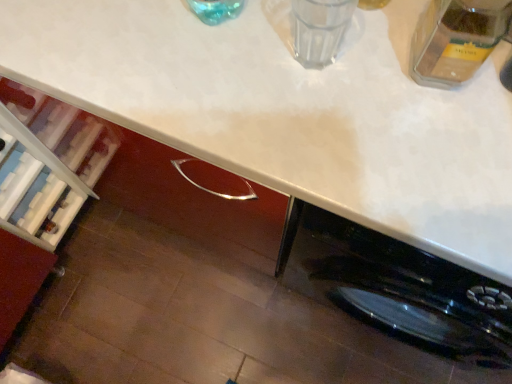
Question: Does transparent glass at upper center have a larger size compared to transparent glass jar at upper right?

Choices:
 (A) yes
 (B) no

Answer: (B)

Question: Could you tell me if transparent glass at upper center is facing transparent glass jar at upper right?

Choices:
 (A) yes
 (B) no

Answer: (B)

Question: Considering the relative sizes of transparent glass at upper center and transparent glass jar at upper right in the image provided, is transparent glass at upper center taller than transparent glass jar at upper right?

Choices:
 (A) no
 (B) yes

Answer: (A)

Question: Is the position of transparent glass at upper center more distant than that of transparent glass jar at upper right?

Choices:
 (A) no
 (B) yes

Answer: (B)

Question: Considering the relative sizes of transparent glass at upper center and transparent glass jar at upper right in the image provided, is transparent glass at upper center shorter than transparent glass jar at upper right?

Choices:
 (A) no
 (B) yes

Answer: (B)

Question: Considering the relative sizes of transparent glass at upper center and transparent glass jar at upper right in the image provided, is transparent glass at upper center thinner than transparent glass jar at upper right?

Choices:
 (A) yes
 (B) no

Answer: (A)

Question: From the image's perspective, is transparent glass jar at upper right located beneath white glossy countertop at upper center?

Choices:
 (A) no
 (B) yes

Answer: (A)

Question: Can you confirm if transparent glass jar at upper right is positioned to the left of white glossy countertop at upper center?

Choices:
 (A) yes
 (B) no

Answer: (B)

Question: Can you confirm if transparent glass jar at upper right is smaller than white glossy countertop at upper center?

Choices:
 (A) no
 (B) yes

Answer: (B)

Question: Is transparent glass jar at upper right turned away from white glossy countertop at upper center?

Choices:
 (A) yes
 (B) no

Answer: (B)

Question: Is transparent glass jar at upper right wider than white glossy countertop at upper center?

Choices:
 (A) yes
 (B) no

Answer: (B)

Question: From the image's perspective, is transparent glass jar at upper right on top of white glossy countertop at upper center?

Choices:
 (A) no
 (B) yes

Answer: (B)

Question: From a real-world perspective, is transparent glass at upper center below white glossy countertop at upper center?

Choices:
 (A) yes
 (B) no

Answer: (B)